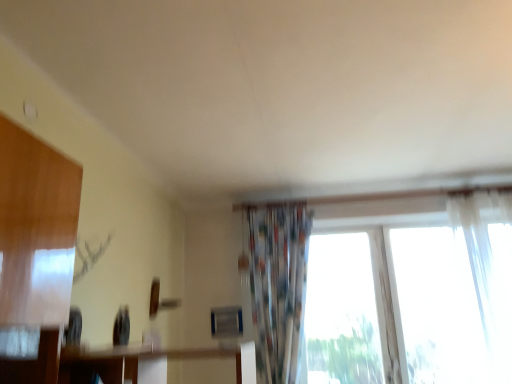
Question: Relative to white sheer curtain at right, which is the second curtain in left-to-right order, is transparent fabric at right in front or behind?

Choices:
 (A) behind
 (B) front

Answer: (A)

Question: Is transparent fabric at right taller or shorter than white sheer curtain at right, which is the second curtain in left-to-right order?

Choices:
 (A) tall
 (B) short

Answer: (B)

Question: Which object is the closest to the transparent fabric at right?

Choices:
 (A) printed fabric curtain at center, which appears as the first curtain when viewed from the left
 (B) white sheer curtain at right, which is the second curtain in left-to-right order

Answer: (B)

Question: Which object is positioned closest to the printed fabric curtain at center, which appears as the first curtain when viewed from the left?

Choices:
 (A) transparent fabric at right
 (B) white sheer curtain at right, which is the second curtain in left-to-right order

Answer: (A)